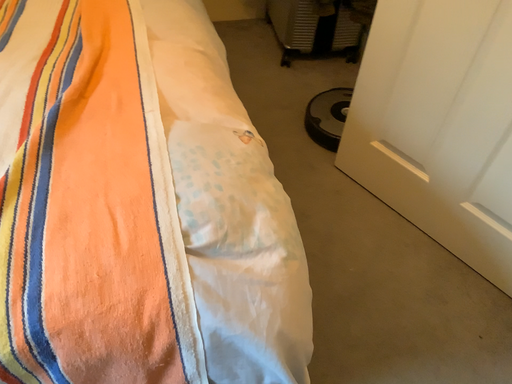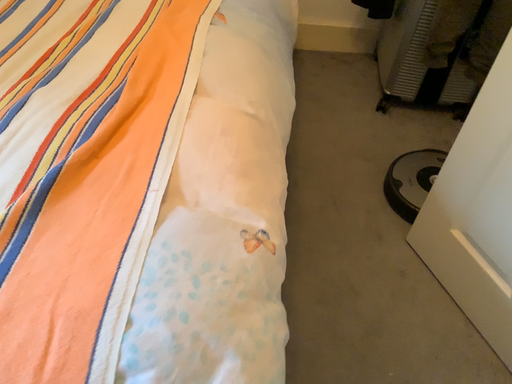
Question: How did the camera likely rotate when shooting the video?

Choices:
 (A) rotated right
 (B) rotated left

Answer: (B)